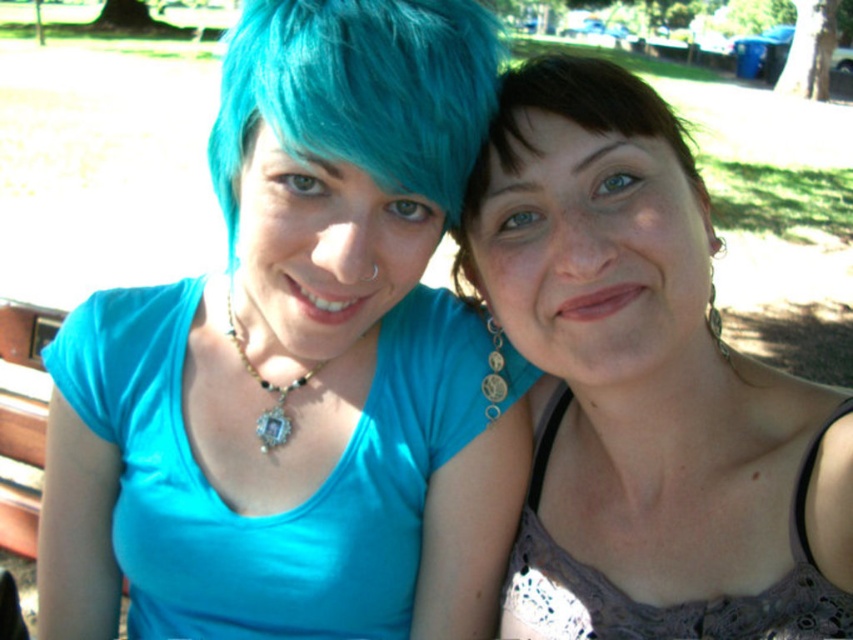
Is brown matte hair at center positioned behind matte glass pendant at center?

No, it is in front of matte glass pendant at center.

Which is in front, point (556, 113) or point (265, 432)?

Point (556, 113) is in front.

You are a GUI agent. You are given a task and a screenshot of the screen. Output one action in this format:
    pyautogui.click(x=<x>, y=<y>)
    Task: Click on the brown matte hair at center
    The height and width of the screenshot is (640, 853).
    Given the screenshot: What is the action you would take?
    pyautogui.click(x=572, y=122)

Can you confirm if matte blue shirt at left is bigger than brown matte hair at center?

Yes, matte blue shirt at left is bigger than brown matte hair at center.

Which is in front, point (305, 45) or point (538, 90)?

Point (305, 45)

Does point (389, 35) come closer to viewer compared to point (548, 104)?

Yes, point (389, 35) is in front of point (548, 104).

Where is `matte blue shirt at left`? The image size is (853, 640). matte blue shirt at left is located at coordinates (297, 364).

Can you confirm if matte purple tank top at center is bigger than matte glass pendant at center?

Yes, matte purple tank top at center is bigger than matte glass pendant at center.

This screenshot has width=853, height=640. Describe the element at coordinates (645, 387) in the screenshot. I see `matte purple tank top at center` at that location.

Does point (512, 326) come farther from viewer compared to point (286, 429)?

No, it is not.

This screenshot has width=853, height=640. What are the coordinates of `matte purple tank top at center` in the screenshot? It's located at (645, 387).